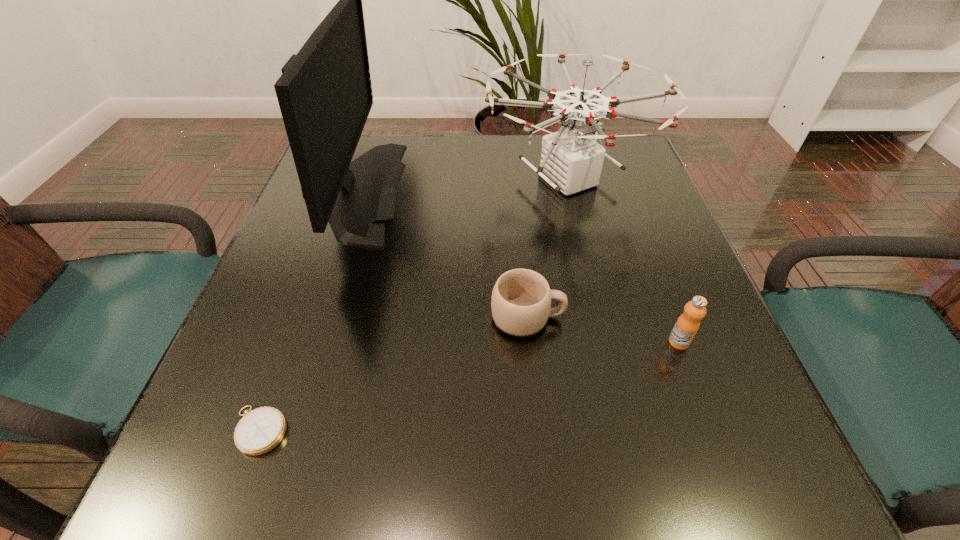
Locate an element on the screen. Image resolution: width=960 pixels, height=540 pixels. object that is at the far right corner is located at coordinates (571, 161).

You are a GUI agent. You are given a task and a screenshot of the screen. Output one action in this format:
    pyautogui.click(x=<x>, y=<y>)
    Task: Click on the vacant space at the far edge
    The width and height of the screenshot is (960, 540).
    Given the screenshot: What is the action you would take?
    pyautogui.click(x=423, y=152)

Locate an element on the screen. The width and height of the screenshot is (960, 540). vacant space at the near edge is located at coordinates (670, 493).

In order to click on free location at the left edge in this screenshot , I will do `click(268, 271)`.

This screenshot has height=540, width=960. In order to click on free space at the right edge of the desktop in this screenshot , I will do `click(636, 258)`.

Image resolution: width=960 pixels, height=540 pixels. In the image, there is a desktop. In order to click on free space at the far right corner in this screenshot , I will do `click(605, 143)`.

The height and width of the screenshot is (540, 960). I want to click on vacant space at the near right corner of the desktop, so click(x=787, y=485).

At what (x,y) coordinates should I click in order to perform the action: click on free space between the nearest object and the fourth tallest object. Please return your answer as a coordinate pair (x, y). The width and height of the screenshot is (960, 540). Looking at the image, I should click on (394, 374).

The width and height of the screenshot is (960, 540). I want to click on free space between the fourth shortest object and the orange juice, so click(624, 261).

Where is `blank region between the tallest object and the fourth tallest object`? The image size is (960, 540). blank region between the tallest object and the fourth tallest object is located at coordinates (440, 254).